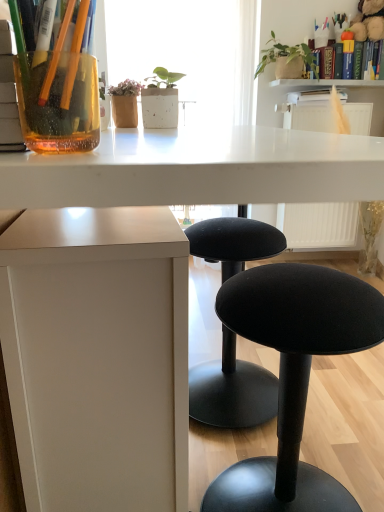
Question: Considering the relative positions of white plastic radiator at upper right and hardcover book at upper right, which ranks as the first book in top-to-bottom order, in the image provided, is white plastic radiator at upper right behind hardcover book at upper right, which ranks as the first book in top-to-bottom order,?

Choices:
 (A) yes
 (B) no

Answer: (B)

Question: From a real-world perspective, is white plastic radiator at upper right located higher than hardcover book at upper right, which ranks as the first book in top-to-bottom order?

Choices:
 (A) no
 (B) yes

Answer: (A)

Question: Is white plastic radiator at upper right wider than hardcover book at upper right, the second book positioned from the left?

Choices:
 (A) no
 (B) yes

Answer: (B)

Question: Does white plastic radiator at upper right turn towards hardcover book at upper right, the first book from the right?

Choices:
 (A) no
 (B) yes

Answer: (A)

Question: Is white plastic radiator at upper right placed right next to hardcover book at upper right, the first book from the right?

Choices:
 (A) no
 (B) yes

Answer: (A)

Question: Is point (319, 75) positioned closer to the camera than point (309, 96)?

Choices:
 (A) farther
 (B) closer

Answer: (B)

Question: In the image, is hardcover book at upper right, the second book positioned from the left, on the left side or the right side of hardcover book at upper center, arranged as the first book when viewed from the left?

Choices:
 (A) right
 (B) left

Answer: (A)

Question: From a real-world perspective, is hardcover book at upper right, the 2th book positioned from the bottom, physically located above or below hardcover book at upper center, acting as the second book starting from the top?

Choices:
 (A) above
 (B) below

Answer: (A)

Question: From the image's perspective, relative to hardcover book at upper center, which is counted as the 2th book, starting from the right, is hardcover book at upper right, the 2th book positioned from the bottom, above or below?

Choices:
 (A) below
 (B) above

Answer: (B)

Question: In the image, is hardcover book at upper right, which ranks as the first book in top-to-bottom order, on the left side or the right side of white textured shelf at upper center?

Choices:
 (A) left
 (B) right

Answer: (B)

Question: Considering the positions of hardcover book at upper right, which ranks as the first book in top-to-bottom order, and white textured shelf at upper center in the image, is hardcover book at upper right, which ranks as the first book in top-to-bottom order, wider or thinner than white textured shelf at upper center?

Choices:
 (A) thin
 (B) wide

Answer: (A)

Question: In terms of height, does hardcover book at upper right, which ranks as the first book in top-to-bottom order, look taller or shorter compared to white textured shelf at upper center?

Choices:
 (A) short
 (B) tall

Answer: (B)

Question: Looking at the image, does hardcover book at upper right, the second book positioned from the left, seem bigger or smaller compared to white textured shelf at upper center?

Choices:
 (A) small
 (B) big

Answer: (B)

Question: In terms of height, does white plastic radiator at upper right look taller or shorter compared to green matte plant at upper right?

Choices:
 (A) short
 (B) tall

Answer: (B)

Question: Looking at their shapes, would you say white plastic radiator at upper right is wider or thinner than green matte plant at upper right?

Choices:
 (A) wide
 (B) thin

Answer: (A)